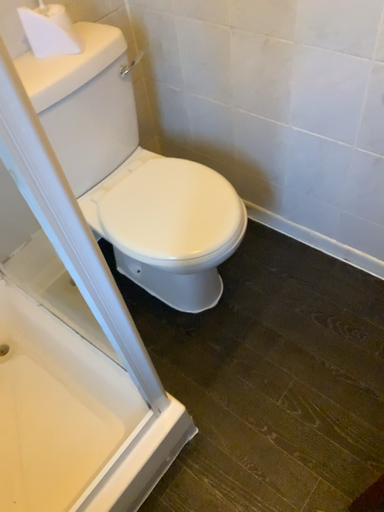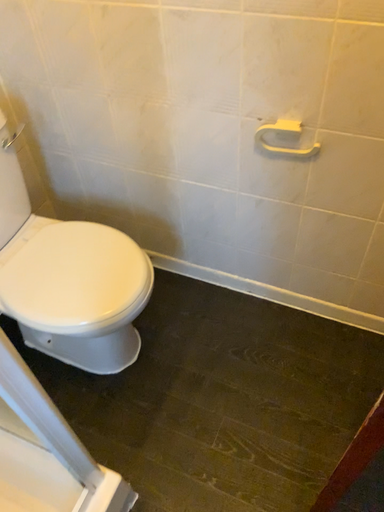
Question: Which way did the camera rotate in the video?

Choices:
 (A) rotated downward
 (B) rotated upward

Answer: (B)